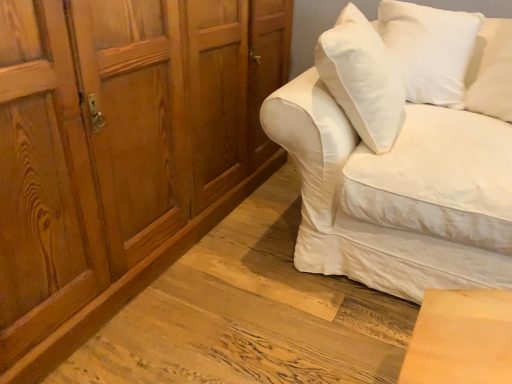
Question: Is wooden cabinet at left turned away from white cotton couch at right?

Choices:
 (A) no
 (B) yes

Answer: (A)

Question: Would you consider wooden cabinet at left to be distant from white cotton couch at right?

Choices:
 (A) yes
 (B) no

Answer: (B)

Question: Could you tell me if wooden cabinet at left is turned towards white cotton couch at right?

Choices:
 (A) no
 (B) yes

Answer: (B)

Question: Would you say white cotton couch at right is part of wooden cabinet at left's contents?

Choices:
 (A) yes
 (B) no

Answer: (B)

Question: Can you confirm if wooden cabinet at left is taller than white cotton couch at right?

Choices:
 (A) yes
 (B) no

Answer: (A)

Question: From the image's perspective, is wooden cabinet at left under white cotton couch at right?

Choices:
 (A) no
 (B) yes

Answer: (A)

Question: From the image's perspective, would you say white cotton couch at right is shown under wooden cabinet at left?

Choices:
 (A) no
 (B) yes

Answer: (B)

Question: Can you confirm if white cotton couch at right is wider than wooden cabinet at left?

Choices:
 (A) no
 (B) yes

Answer: (B)

Question: Does white cotton couch at right have a lesser height compared to wooden cabinet at left?

Choices:
 (A) yes
 (B) no

Answer: (A)

Question: From a real-world perspective, does white cotton couch at right sit lower than wooden cabinet at left?

Choices:
 (A) yes
 (B) no

Answer: (A)

Question: Can you confirm if white cotton couch at right is taller than wooden cabinet at left?

Choices:
 (A) yes
 (B) no

Answer: (B)

Question: Does white cotton couch at right appear on the left side of wooden cabinet at left?

Choices:
 (A) no
 (B) yes

Answer: (A)

Question: Considering the relative sizes of wooden cabinet at left and white soft cushion at upper right in the image provided, is wooden cabinet at left thinner than white soft cushion at upper right?

Choices:
 (A) no
 (B) yes

Answer: (A)